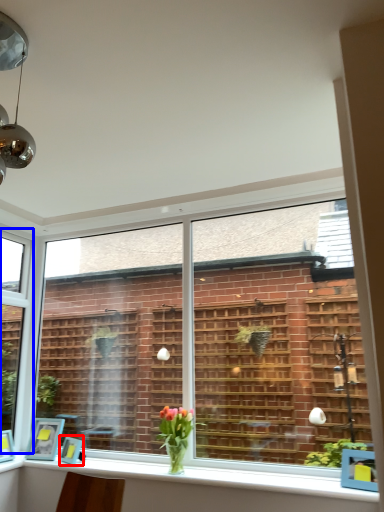
Question: Which object appears closest to the camera in this image, picture frame (highlighted by a red box) or window (highlighted by a blue box)?

Choices:
 (A) picture frame
 (B) window

Answer: (A)